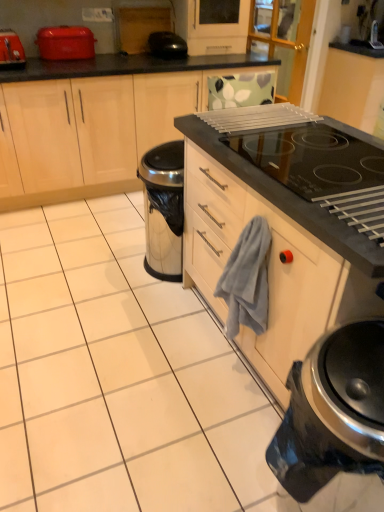
Question: Is black glossy toaster at upper center further to camera compared to black glass oven at upper right?

Choices:
 (A) yes
 (B) no

Answer: (A)

Question: Is black glossy toaster at upper center positioned in front of black glass oven at upper right?

Choices:
 (A) yes
 (B) no

Answer: (B)

Question: Is black glossy toaster at upper center looking in the opposite direction of black glass oven at upper right?

Choices:
 (A) no
 (B) yes

Answer: (A)

Question: Is black glass oven at upper right located within black glossy toaster at upper center?

Choices:
 (A) no
 (B) yes

Answer: (A)

Question: Does black glossy toaster at upper center appear on the left side of black glass oven at upper right?

Choices:
 (A) yes
 (B) no

Answer: (A)

Question: Based on their positions, is satin black kettle at lower right, arranged as the 1th kitchen appliance when viewed from the right, located to the left or right of matte wood cabinets at left?

Choices:
 (A) left
 (B) right

Answer: (B)

Question: Would you say satin black kettle at lower right, arranged as the 1th kitchen appliance when viewed from the right, is inside or outside matte wood cabinets at left?

Choices:
 (A) outside
 (B) inside

Answer: (A)

Question: In terms of height, does satin black kettle at lower right, the third kitchen appliance when ordered from top to bottom, look taller or shorter compared to matte wood cabinets at left?

Choices:
 (A) tall
 (B) short

Answer: (B)

Question: Looking at their shapes, would you say satin black kettle at lower right, arranged as the 1th kitchen appliance when ordered from the bottom, is wider or thinner than matte wood cabinets at left?

Choices:
 (A) thin
 (B) wide

Answer: (A)

Question: Relative to satin black kettle at lower right, the 3th kitchen appliance from the back, is matte red toaster at upper left, which is the 1th kitchen appliance in top-to-bottom order, in front or behind?

Choices:
 (A) behind
 (B) front

Answer: (A)

Question: Does point (82, 56) appear closer or farther from the camera than point (374, 423)?

Choices:
 (A) closer
 (B) farther

Answer: (B)

Question: Is matte red toaster at upper left, acting as the 2th kitchen appliance starting from the left, taller or shorter than satin black kettle at lower right, arranged as the 1th kitchen appliance when ordered from the bottom?

Choices:
 (A) short
 (B) tall

Answer: (A)

Question: From a real-world perspective, relative to satin black kettle at lower right, the third kitchen appliance when ordered from top to bottom, is matte red toaster at upper left, which is the 3th kitchen appliance from front to back, vertically above or below?

Choices:
 (A) below
 (B) above

Answer: (B)

Question: Is matte red toaster at upper left, the second kitchen appliance from the back, taller or shorter than gray cotton hand towel at center?

Choices:
 (A) short
 (B) tall

Answer: (A)

Question: From the image's perspective, is matte red toaster at upper left, the 1th kitchen appliance in the left-to-right sequence, above or below gray cotton hand towel at center?

Choices:
 (A) below
 (B) above

Answer: (B)